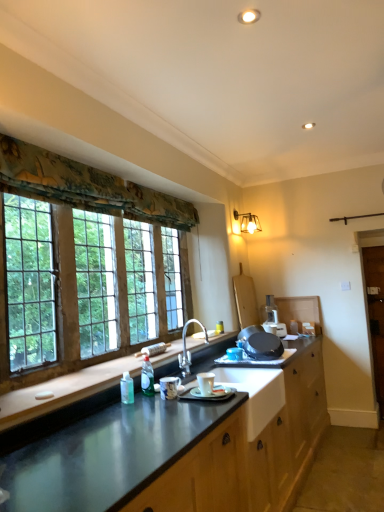
This screenshot has height=512, width=384. What do you see at coordinates (65, 303) in the screenshot?
I see `clear glass window at left` at bounding box center [65, 303].

Describe the element at coordinates (186, 349) in the screenshot. I see `white ceramic sink at center` at that location.

I want to click on clear glass window at left, so click(65, 303).

Is brown wooden barn door at right at the back of floral fabric curtain at upper left?

No, floral fabric curtain at upper left's orientation is not away from brown wooden barn door at right.

Is brown wooden barn door at right a part of floral fabric curtain at upper left?

No, brown wooden barn door at right is not a part of floral fabric curtain at upper left.

Considering the sizes of floral fabric curtain at upper left and brown wooden barn door at right in the image, is floral fabric curtain at upper left bigger or smaller than brown wooden barn door at right?

floral fabric curtain at upper left is bigger than brown wooden barn door at right.

From a real-world perspective, is floral fabric curtain at upper left physically below brown wooden barn door at right?

Actually, floral fabric curtain at upper left is physically above brown wooden barn door at right in the real world.

Could you tell me if white ceramic sink at center is turned towards metallic wall sconce at upper right?

No, white ceramic sink at center is not facing towards metallic wall sconce at upper right.

How many degrees apart are the facing directions of white ceramic sink at center and metallic wall sconce at upper right?

The facing directions of white ceramic sink at center and metallic wall sconce at upper right are 0.475 degrees apart.

Considering the points (184, 342) and (253, 222), which point is behind, point (184, 342) or point (253, 222)?

The point (253, 222) is farther.

From the image's perspective, which is above, white ceramic sink at center or metallic wall sconce at upper right?

metallic wall sconce at upper right appears higher in the image.

Is brown wooden barn door at right turned away from metallic gray countertop at center, the second countertop when ordered from top to bottom?

brown wooden barn door at right does not have its back to metallic gray countertop at center, the second countertop when ordered from top to bottom.

Is brown wooden barn door at right smaller than metallic gray countertop at center, acting as the first countertop starting from the bottom?

Yes, brown wooden barn door at right is smaller than metallic gray countertop at center, acting as the first countertop starting from the bottom.

Is brown wooden barn door at right not within metallic gray countertop at center, acting as the first countertop starting from the bottom?

That's correct, brown wooden barn door at right is outside of metallic gray countertop at center, acting as the first countertop starting from the bottom.

Between brown wooden barn door at right and metallic gray countertop at center, acting as the first countertop starting from the bottom, which one has less height?

With less height is metallic gray countertop at center, acting as the first countertop starting from the bottom.

Which of these two, metallic gray countertop at center, acting as the first countertop starting from the bottom, or brown wooden barn door at right, is bigger?

Bigger between the two is metallic gray countertop at center, acting as the first countertop starting from the bottom.

From the image's perspective, which is below, metallic gray countertop at center, acting as the first countertop starting from the bottom, or brown wooden barn door at right?

From the image's view, metallic gray countertop at center, acting as the first countertop starting from the bottom, is below.

Which is correct: metallic gray countertop at center, acting as the first countertop starting from the bottom, is inside brown wooden barn door at right, or outside of it?

metallic gray countertop at center, acting as the first countertop starting from the bottom, is located beyond the bounds of brown wooden barn door at right.

Does metallic gray countertop at center, acting as the first countertop starting from the bottom, turn towards brown wooden barn door at right?

No, metallic gray countertop at center, acting as the first countertop starting from the bottom, does not turn towards brown wooden barn door at right.

Considering the sizes of objects metallic wall sconce at upper right and brown wooden barn door at right in the image provided, who is smaller, metallic wall sconce at upper right or brown wooden barn door at right?

Smaller between the two is metallic wall sconce at upper right.

Considering their positions, is metallic wall sconce at upper right located in front of or behind brown wooden barn door at right?

In the image, metallic wall sconce at upper right appears behind brown wooden barn door at right.

The height and width of the screenshot is (512, 384). Find the location of `light fixture behind the brown wooden barn door at right`. light fixture behind the brown wooden barn door at right is located at coordinates tap(247, 222).

Does floral fabric curtain at upper left have a lesser height compared to metallic wall sconce at upper right?

Incorrect, the height of floral fabric curtain at upper left does not fall short of that of metallic wall sconce at upper right.

Is floral fabric curtain at upper left positioned before metallic wall sconce at upper right?

Yes, floral fabric curtain at upper left is closer to the camera.

Which of these two, floral fabric curtain at upper left or metallic wall sconce at upper right, is smaller?

metallic wall sconce at upper right.

Considering the sizes of objects white ceramic sink at center and metallic gray countertop at center, the second countertop when ordered from top to bottom, in the image provided, who is bigger, white ceramic sink at center or metallic gray countertop at center, the second countertop when ordered from top to bottom,?

metallic gray countertop at center, the second countertop when ordered from top to bottom, is bigger.

There is a white ceramic sink at center. Identify the location of the 2nd countertop below it (from a real-world perspective). The width and height of the screenshot is (384, 512). (177, 452).

From a real-world perspective, is white ceramic sink at center located higher than metallic gray countertop at center, the second countertop when ordered from top to bottom?

Yes.

Considering the relative sizes of white ceramic sink at center and metallic gray countertop at center, acting as the first countertop starting from the bottom, in the image provided, is white ceramic sink at center thinner than metallic gray countertop at center, acting as the first countertop starting from the bottom,?

Yes, white ceramic sink at center is thinner than metallic gray countertop at center, acting as the first countertop starting from the bottom.

You are a GUI agent. You are given a task and a screenshot of the screen. Output one action in this format:
    pyautogui.click(x=<x>, y=<y>)
    Task: Click on the barn door on the right of floral fabric curtain at upper left
    This screenshot has width=384, height=512.
    Given the screenshot: What is the action you would take?
    pyautogui.click(x=376, y=314)

The height and width of the screenshot is (512, 384). In order to click on sink on the left of metallic wall sconce at upper right in this screenshot , I will do `click(186, 349)`.

Based on their spatial positions, is brown wooden barn door at right or metallic wall sconce at upper right closer to metallic gray countertop at center, acting as the first countertop starting from the bottom?

brown wooden barn door at right.

From the image, which object appears to be nearer to metallic gray countertop at center, the second countertop when ordered from top to bottom, metallic wall sconce at upper right or white plastic food processor at center?

white plastic food processor at center lies closer to metallic gray countertop at center, the second countertop when ordered from top to bottom, than the other object.

Looking at this image, estimate the real-world distances between objects in this image. Which object is further from metallic gray countertop at lower center, which is the 2th countertop in bottom-to-top order, white ceramic sink at center or floral fabric curtain at upper left?

The object further to metallic gray countertop at lower center, which is the 2th countertop in bottom-to-top order, is floral fabric curtain at upper left.

When comparing their distances from floral fabric curtain at upper left, does metallic gray countertop at center, the second countertop when ordered from top to bottom, or white plastic food processor at center seem closer?

The object closer to floral fabric curtain at upper left is metallic gray countertop at center, the second countertop when ordered from top to bottom.

Which object lies nearer to the anchor point floral fabric curtain at upper left, clear glass window at left or white ceramic sink at center?

Among the two, clear glass window at left is located nearer to floral fabric curtain at upper left.

Estimate the real-world distances between objects in this image. Which object is closer to metallic gray countertop at lower center, which is the 2th countertop in bottom-to-top order, white plastic food processor at center or brown wooden barn door at right?

white plastic food processor at center is positioned closer to the anchor metallic gray countertop at lower center, which is the 2th countertop in bottom-to-top order.

Based on their spatial positions, is brown wooden barn door at right or white ceramic sink at center further from clear glass window at left?

brown wooden barn door at right.

Which object lies further to the anchor point clear glass window at left, metallic gray countertop at lower center, arranged as the 1th countertop when viewed from the top, or metallic wall sconce at upper right?

metallic wall sconce at upper right is further to clear glass window at left.

This screenshot has width=384, height=512. What are the coordinates of `window between metallic gray countertop at lower center, which is the 2th countertop in bottom-to-top order, and white plastic food processor at center from front to back` in the screenshot? It's located at (65, 303).

Find the location of a particular element. The width and height of the screenshot is (384, 512). curtain located between metallic gray countertop at lower center, which is the 2th countertop in bottom-to-top order, and brown wooden barn door at right in the depth direction is located at coordinates (86, 187).

Locate an element on the screen. window between floral fabric curtain at upper left and metallic gray countertop at lower center, arranged as the 1th countertop when viewed from the top, in the vertical direction is located at coordinates (65, 303).

Locate an element on the screen. This screenshot has height=512, width=384. appliance located between metallic gray countertop at lower center, which is the 2th countertop in bottom-to-top order, and metallic wall sconce at upper right in the depth direction is located at coordinates (273, 318).